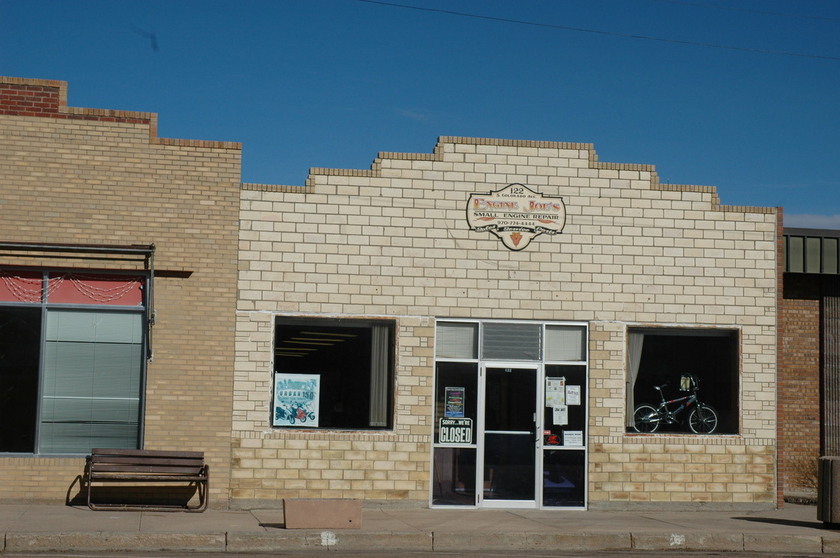
At what (x,y) coordinates should I click in order to perform the action: click on brick wall. Please return your answer as a coordinate pair (x, y). Looking at the image, I should click on coord(580,283).